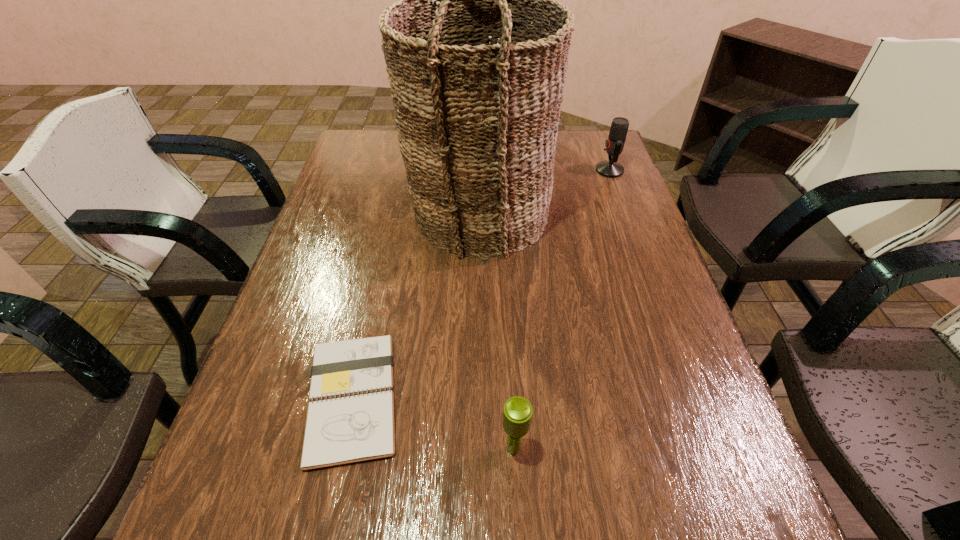
Locate an element on the screen. The image size is (960, 540). vacant region that satisfies the following two spatial constraints: 1. on the side of the rightmost object with the red ring; 2. on the front side of the tallest object is located at coordinates (626, 213).

At what (x,y) coordinates should I click in order to perform the action: click on free spot that satisfies the following two spatial constraints: 1. on the side of the right microphone with the red ring; 2. on the front side of the basket. Please return your answer as a coordinate pair (x, y). The width and height of the screenshot is (960, 540). Looking at the image, I should click on (626, 213).

Where is `free spot that satisfies the following two spatial constraints: 1. on the side of the farther microphone with the red ring; 2. on the front side of the tallest object`? The height and width of the screenshot is (540, 960). free spot that satisfies the following two spatial constraints: 1. on the side of the farther microphone with the red ring; 2. on the front side of the tallest object is located at coordinates (626, 213).